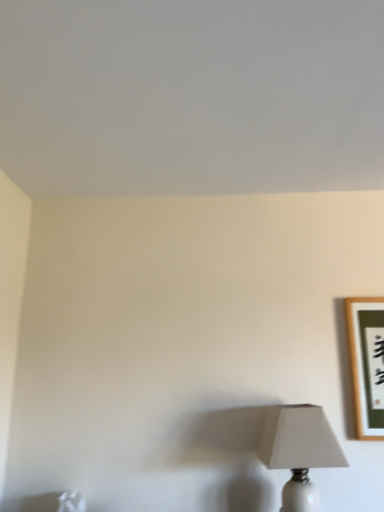
Question: Does white ceramic lamp at lower right turn towards wooden framed artwork at upper right?

Choices:
 (A) yes
 (B) no

Answer: (B)

Question: Is white ceramic lamp at lower right at the left side of wooden framed artwork at upper right?

Choices:
 (A) yes
 (B) no

Answer: (A)

Question: Is white ceramic lamp at lower right closer to the viewer compared to wooden framed artwork at upper right?

Choices:
 (A) yes
 (B) no

Answer: (A)

Question: Considering the relative sizes of white ceramic lamp at lower right and wooden framed artwork at upper right in the image provided, is white ceramic lamp at lower right bigger than wooden framed artwork at upper right?

Choices:
 (A) yes
 (B) no

Answer: (A)

Question: Can wooden framed artwork at upper right be found inside white ceramic lamp at lower right?

Choices:
 (A) no
 (B) yes

Answer: (A)

Question: From the image's perspective, would you say white ceramic lamp at lower right is positioned over wooden framed artwork at upper right?

Choices:
 (A) no
 (B) yes

Answer: (A)

Question: From the image's perspective, does wooden framed artwork at upper right appear lower than white ceramic lamp at lower right?

Choices:
 (A) no
 (B) yes

Answer: (A)

Question: From a real-world perspective, is wooden framed artwork at upper right positioned under white ceramic lamp at lower right based on gravity?

Choices:
 (A) yes
 (B) no

Answer: (B)

Question: Is wooden framed artwork at upper right smaller than white ceramic lamp at lower right?

Choices:
 (A) yes
 (B) no

Answer: (A)

Question: Is wooden framed artwork at upper right at the left side of white ceramic lamp at lower right?

Choices:
 (A) yes
 (B) no

Answer: (B)

Question: From a real-world perspective, is wooden framed artwork at upper right on top of white ceramic lamp at lower right?

Choices:
 (A) yes
 (B) no

Answer: (A)

Question: Is wooden framed artwork at upper right taller than white ceramic lamp at lower right?

Choices:
 (A) yes
 (B) no

Answer: (A)

Question: Considering the positions of white ceramic lamp at lower right and wooden framed artwork at upper right in the image, is white ceramic lamp at lower right bigger or smaller than wooden framed artwork at upper right?

Choices:
 (A) small
 (B) big

Answer: (B)